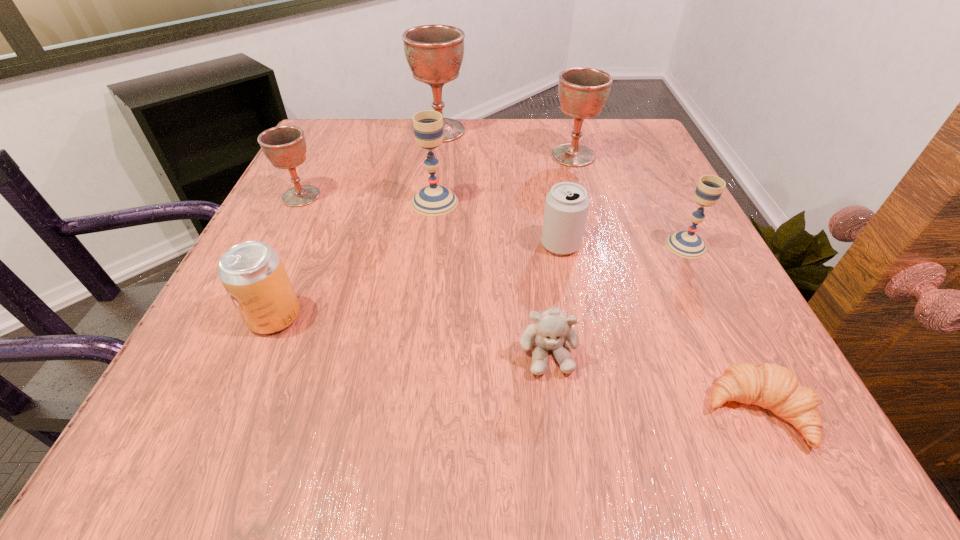
You are a GUI agent. You are given a task and a screenshot of the screen. Output one action in this format:
    pyautogui.click(x=<x>, y=<y>)
    Task: Click on the closest brown chalice to the tallest object
    The width and height of the screenshot is (960, 540).
    Given the screenshot: What is the action you would take?
    pyautogui.click(x=583, y=91)

I want to click on free space that satisfies the following two spatial constraints: 1. on the face of the teddy bear; 2. on the left side of the shortest object, so pyautogui.click(x=556, y=411).

The height and width of the screenshot is (540, 960). Identify the location of free space that satisfies the following two spatial constraints: 1. on the back side of the rightmost brown chalice; 2. on the right side of the leftmost chalice. (321, 156).